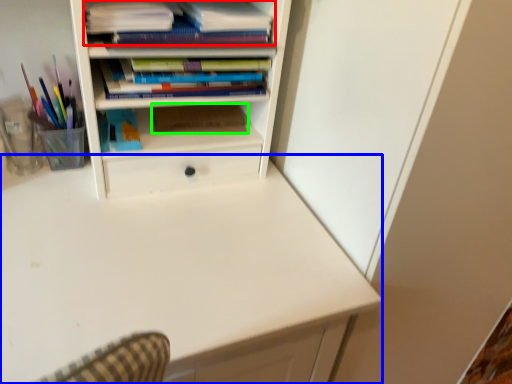
Question: Which is nearer to the book (highlighted by a red box)? computer desk (highlighted by a blue box) or paperback book (highlighted by a green box).

Choices:
 (A) computer desk
 (B) paperback book

Answer: (B)